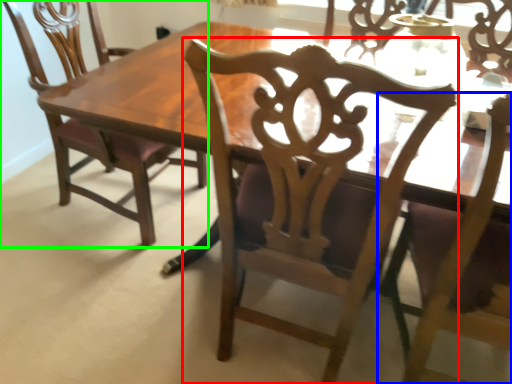
Question: Considering the real-world distances, which object is closest to chair (highlighted by a red box)? chair (highlighted by a blue box) or chair (highlighted by a green box).

Choices:
 (A) chair
 (B) chair

Answer: (A)